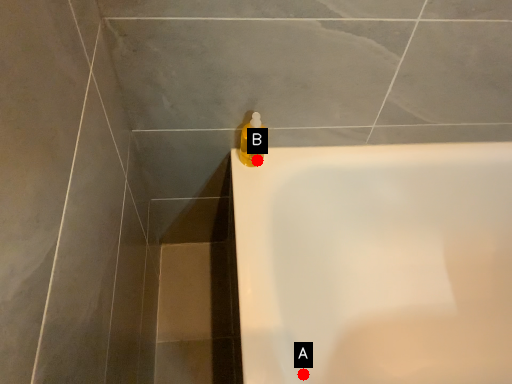
Question: Two points are circled on the image, labeled by A and B beside each circle. Among these points, which one is farthest from the camera?

Choices:
 (A) A is further
 (B) B is further

Answer: (B)